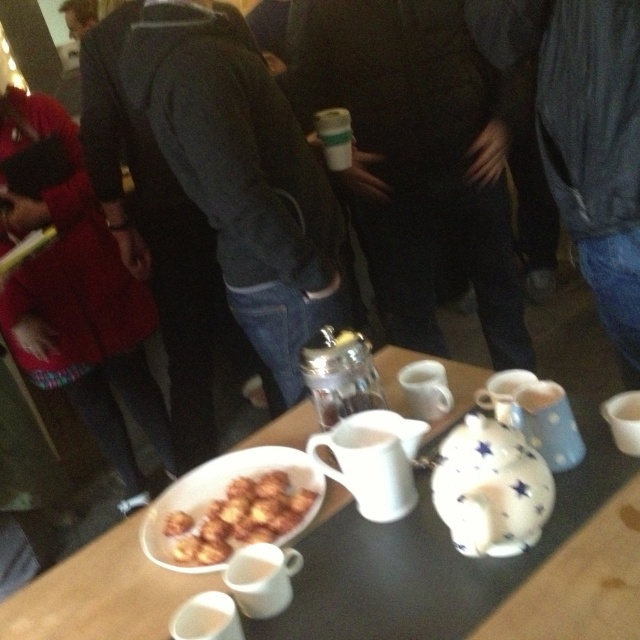
Question: Is red fleece jacket at left positioned before white ceramic coffee cup at center?

Choices:
 (A) no
 (B) yes

Answer: (A)

Question: Which of the following is the closest to the observer?

Choices:
 (A) (632, 403)
 (B) (508, 60)
 (C) (42, 349)

Answer: (A)

Question: Does wooden table at center appear on the right side of white matte cup at lower center?

Choices:
 (A) no
 (B) yes

Answer: (A)

Question: Does matte black jacket at center appear under white paper cup at center?

Choices:
 (A) yes
 (B) no

Answer: (A)

Question: Which object appears closest to the camera in this image?

Choices:
 (A) white paper cup at center
 (B) white matte cup at lower center
 (C) red fleece jacket at left

Answer: (B)

Question: Among these points, which one is nearest to the camera?

Choices:
 (A) (244, 554)
 (B) (534, 419)

Answer: (A)